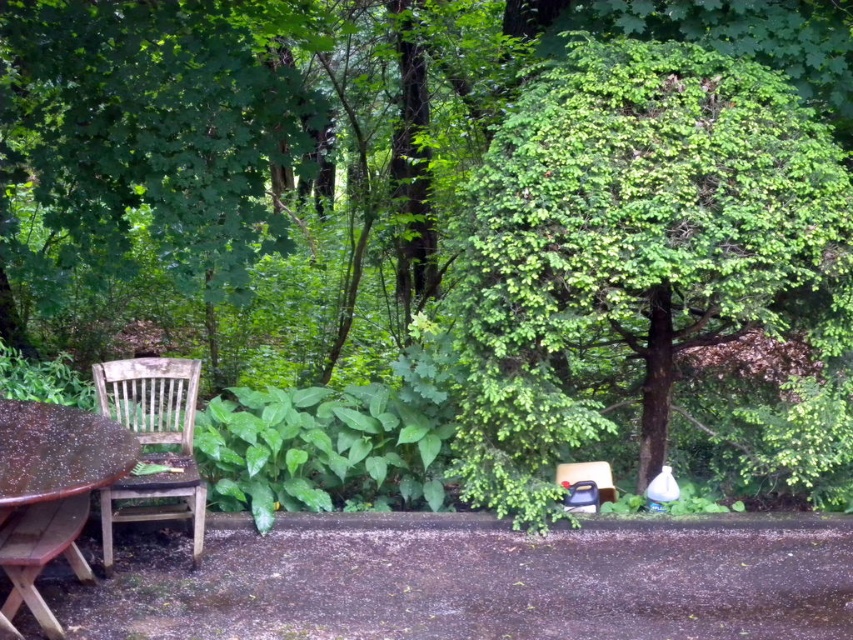
Is point (505, 440) positioned behind point (143, 385)?

No.

Is point (735, 298) in front of point (136, 372)?

Yes, it is.

Where is `green leafy tree at center`? This screenshot has height=640, width=853. green leafy tree at center is located at coordinates (631, 240).

Is the position of green leafy tree at center more distant than that of wooden picnic table at lower left?

Yes, it is.

Which is more to the left, green leafy tree at center or wooden picnic table at lower left?

From the viewer's perspective, wooden picnic table at lower left appears more on the left side.

You are a GUI agent. You are given a task and a screenshot of the screen. Output one action in this format:
    pyautogui.click(x=<x>, y=<y>)
    Task: Click on the green leafy tree at center
    
    Given the screenshot: What is the action you would take?
    pyautogui.click(x=631, y=240)

Identify the location of green leafy tree at center. (631, 240).

Between point (0, 516) and point (149, 458), which one is positioned behind?

Positioned behind is point (149, 458).

Locate an element on the screen. wooden picnic table at lower left is located at coordinates (56, 465).